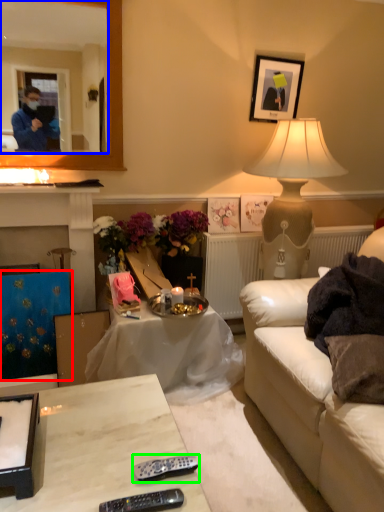
Question: Estimate the real-world distances between objects in this image. Which object is closer to curtain (highlighted by a red box), mirror (highlighted by a blue box) or remote (highlighted by a green box)?

Choices:
 (A) mirror
 (B) remote

Answer: (A)